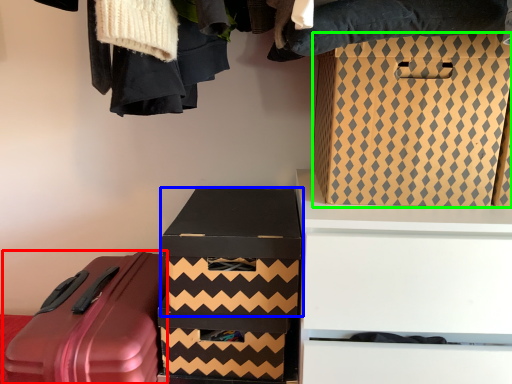
Question: Considering the real-world distances, which object is closest to suitcase (highlighted by a red box)? box (highlighted by a blue box) or box (highlighted by a green box).

Choices:
 (A) box
 (B) box

Answer: (A)